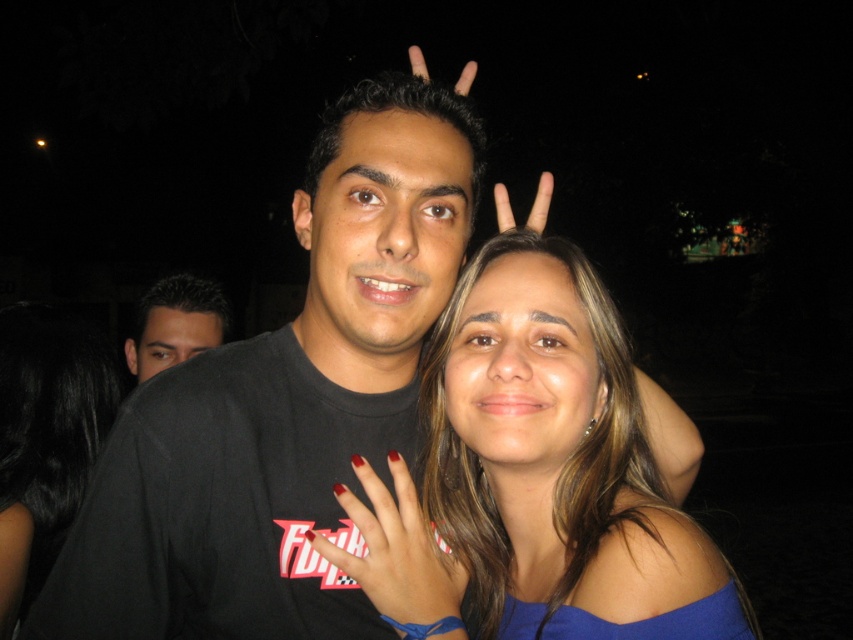
You are a photographer setting up a night portrait. You notice the nail polish at center and the matte black hand at upper center in the frame. Which object appears narrower in the image?

The nail polish at center appears narrower because its width is less than that of the matte black hand at upper center.

You are a photographer trying to focus on two points in the image. The first point is point (506,612) and the second point is point (402,573). Which point should you focus on if you want to capture the one that is closer to the camera?

Point (402,573) is closer to the camera than point (506,612), so you should focus on point (402,573) to capture the one that is closer to the camera.